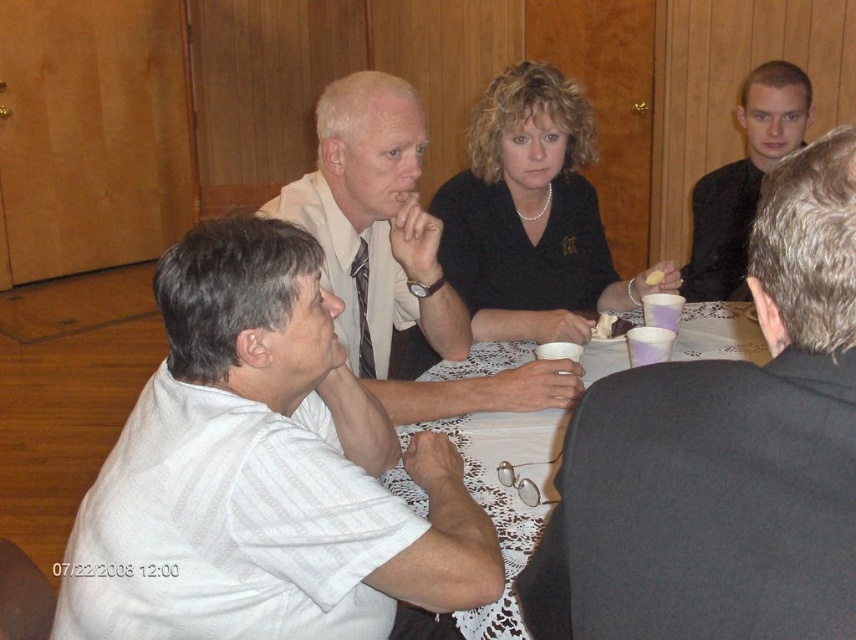
Is dark gray suit at upper right to the right of black smooth shirt at upper right from the viewer's perspective?

Incorrect, dark gray suit at upper right is not on the right side of black smooth shirt at upper right.

Is dark gray suit at upper right positioned in front of black smooth shirt at upper right?

Yes, dark gray suit at upper right is closer to the viewer.

Is point (843, 184) positioned in front of point (742, 99)?

Yes, it is in front of point (742, 99).

This screenshot has height=640, width=856. In order to click on dark gray suit at upper right in this screenshot , I will do `click(723, 456)`.

Between white shirt at center and black smooth shirt at upper right, which one is positioned higher?

black smooth shirt at upper right

Does point (425, 308) lie in front of point (746, 134)?

Yes, point (425, 308) is closer to viewer.

Locate an element on the screen. The width and height of the screenshot is (856, 640). white shirt at center is located at coordinates (396, 256).

From the picture: Is black matte shirt at center to the left of black smooth shirt at upper right from the viewer's perspective?

Correct, you'll find black matte shirt at center to the left of black smooth shirt at upper right.

Does black matte shirt at center have a smaller size compared to black smooth shirt at upper right?

Indeed, black matte shirt at center has a smaller size compared to black smooth shirt at upper right.

Is point (474, 273) positioned after point (773, 65)?

No, (474, 273) is in front of (773, 65).

The image size is (856, 640). Identify the location of black matte shirt at center. 532,216.